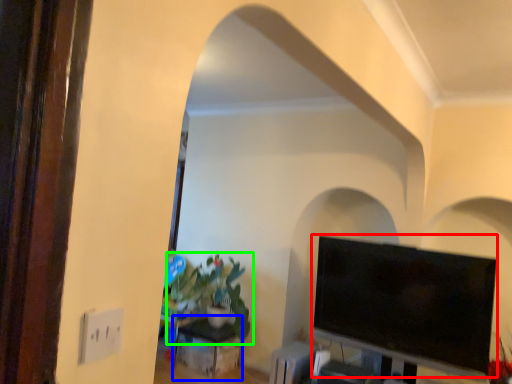
Question: Which object is the farthest from television (highlighted by a red box)? Choose among these: table (highlighted by a blue box) or houseplant (highlighted by a green box).

Choices:
 (A) table
 (B) houseplant

Answer: (A)